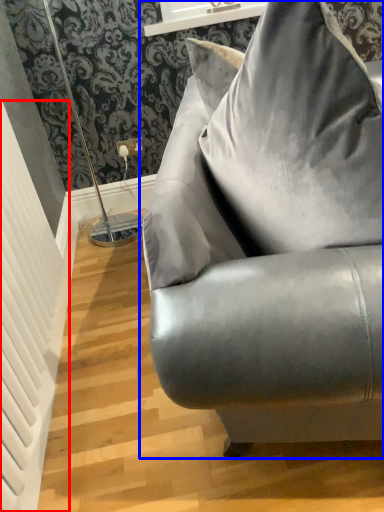
Question: Which object appears farthest to the camera in this image, radiator (highlighted by a red box) or studio couch (highlighted by a blue box)?

Choices:
 (A) radiator
 (B) studio couch

Answer: (A)